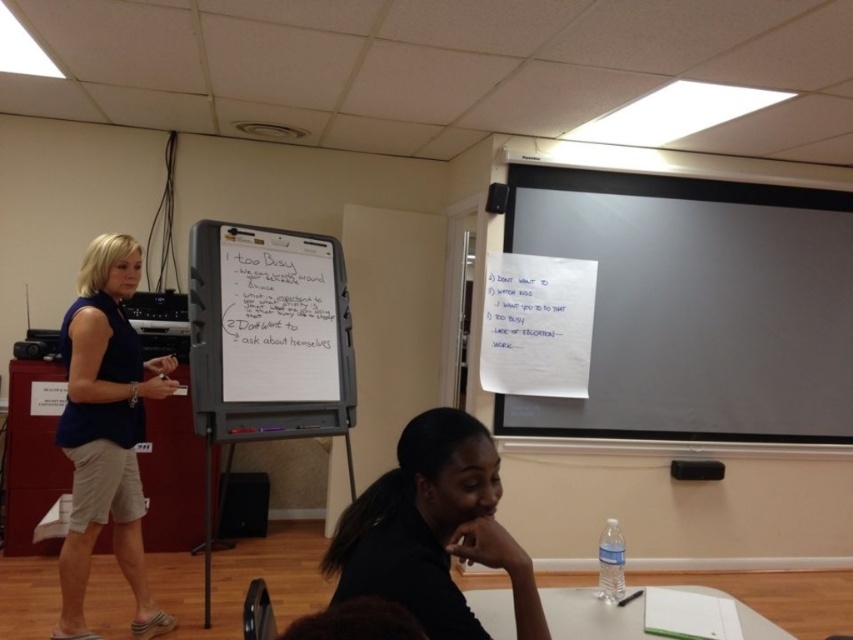
You are a student sitting in the classroom and you see the black matte shirt at lower center and the blue cotton shirt at center. Which shirt is closer to you?

The black matte shirt at lower center is closer to you because it is in front of the blue cotton shirt at center.

You are a student sitting in the classroom and you see the black matte shirt at lower center and the blue cotton shirt at center. Which shirt is positioned more to the right?

The black matte shirt at lower center is positioned to the right of the blue cotton shirt at center, so the black matte shirt at lower center is more to the right.